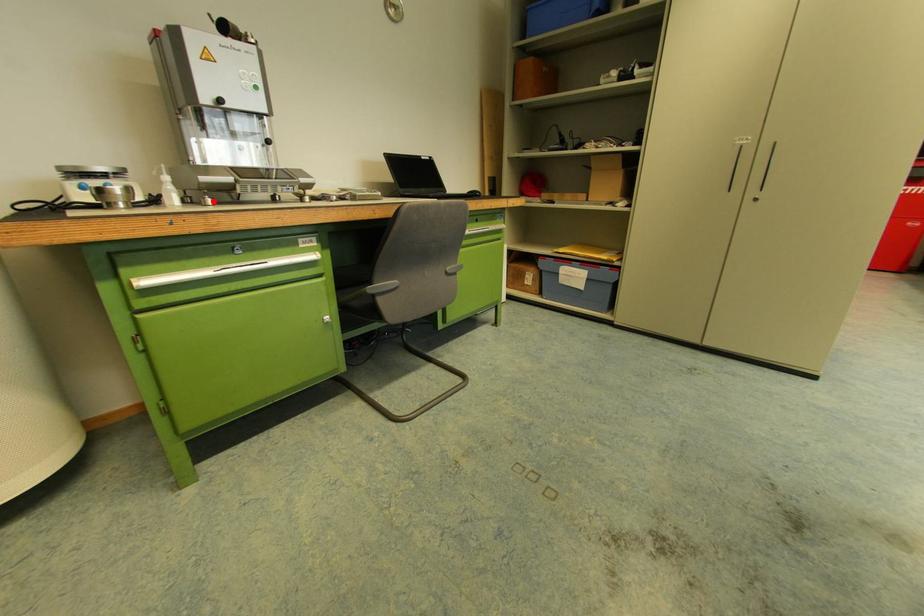
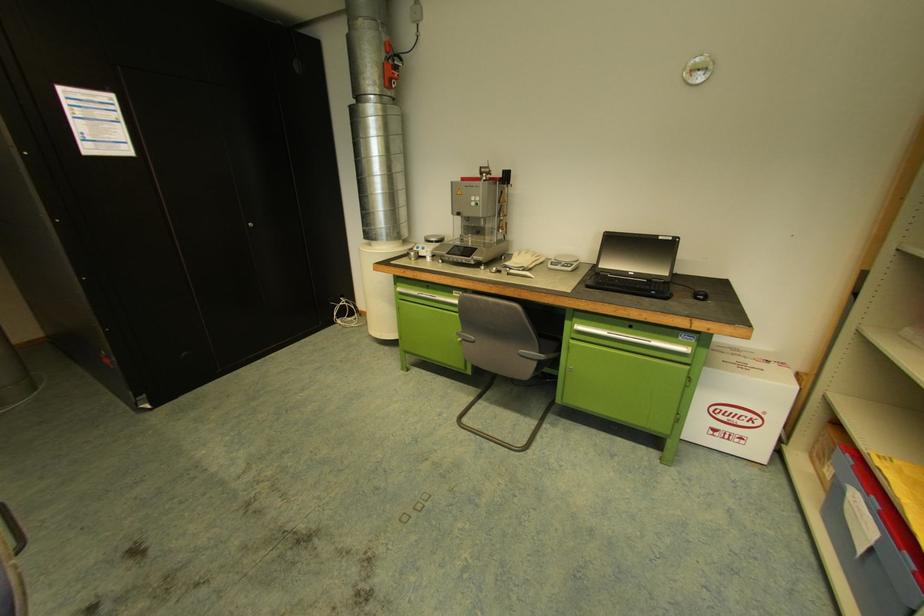
Find the pixel in the second image that matches the highlighted location in the first image.

(444, 261)